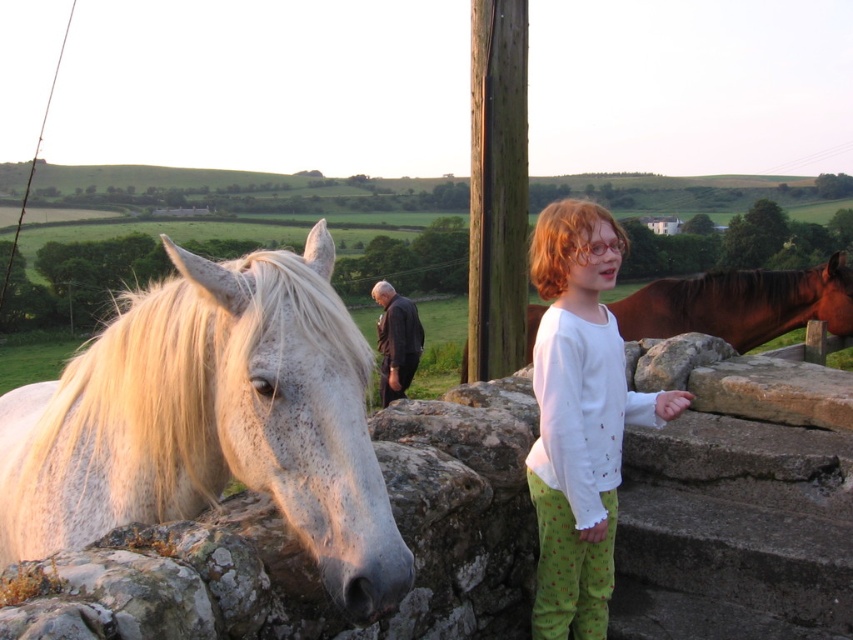
Question: Which of the following is the closest to the observer?

Choices:
 (A) white cotton shirt at upper right
 (B) shiny brown horse at right

Answer: (A)

Question: Which object appears farthest from the camera in this image?

Choices:
 (A) shiny brown horse at right
 (B) white speckled fur at left

Answer: (A)

Question: Is white speckled fur at left to the left of white cotton shirt at upper right from the viewer's perspective?

Choices:
 (A) yes
 (B) no

Answer: (A)

Question: Which of the following is the farthest from the observer?

Choices:
 (A) white cotton shirt at upper right
 (B) white speckled fur at left
 (C) shiny brown horse at right

Answer: (C)

Question: Does white cotton shirt at upper right appear on the right side of shiny brown horse at right?

Choices:
 (A) no
 (B) yes

Answer: (A)

Question: Can you confirm if white speckled fur at left is positioned above shiny brown horse at right?

Choices:
 (A) no
 (B) yes

Answer: (A)